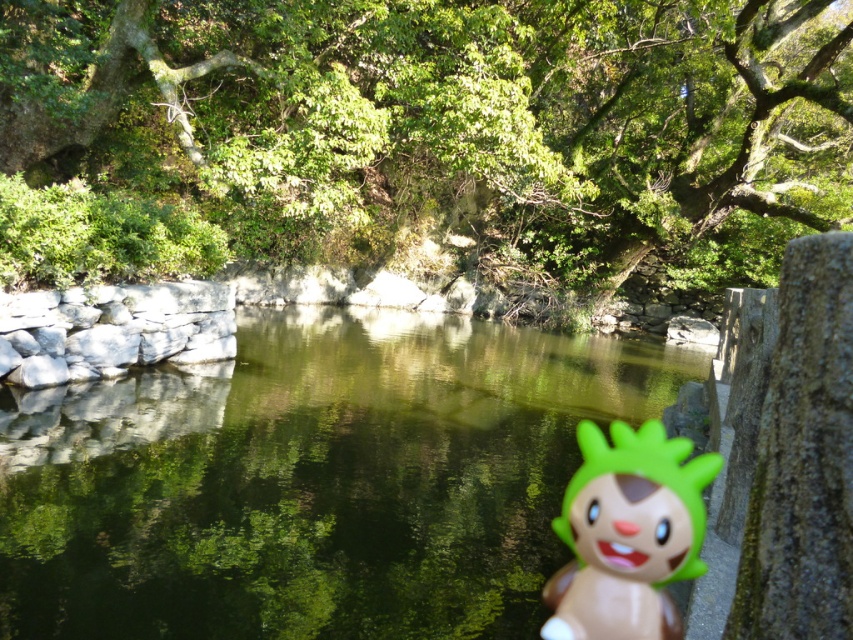
Does green reflective water at center appear over green plastic toy at right?

No.

Describe the element at coordinates (312, 481) in the screenshot. This screenshot has width=853, height=640. I see `green reflective water at center` at that location.

Does point (459, 384) lie behind point (657, 570)?

Yes, it is behind point (657, 570).

Find the location of a particular element. The width and height of the screenshot is (853, 640). green reflective water at center is located at coordinates (312, 481).

Is green leafy tree at upper center taller than green reflective water at center?

Indeed, green leafy tree at upper center has a greater height compared to green reflective water at center.

Between point (167, 131) and point (438, 500), which one is positioned in front?

Positioned in front is point (438, 500).

Between point (715, 216) and point (503, 627), which one is positioned in front?

Point (503, 627)

Find the location of `green leafy tree at upper center`. green leafy tree at upper center is located at coordinates (450, 122).

Is green leafy tree at upper center shorter than green plastic toy at right?

No, green leafy tree at upper center is not shorter than green plastic toy at right.

Locate an element on the screen. green leafy tree at upper center is located at coordinates (450, 122).